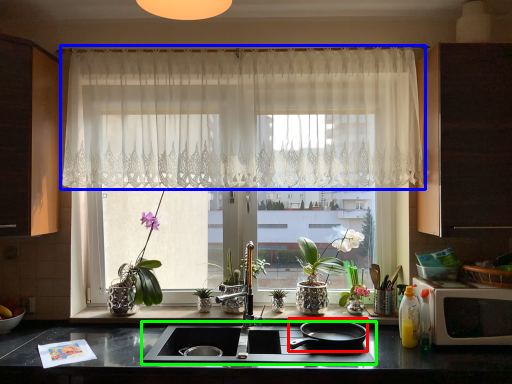
Question: Based on their relative distances, which object is nearer to frying pan (highlighted by a red box)? Choose from curtain (highlighted by a blue box) and gas stove (highlighted by a green box).

Choices:
 (A) curtain
 (B) gas stove

Answer: (B)